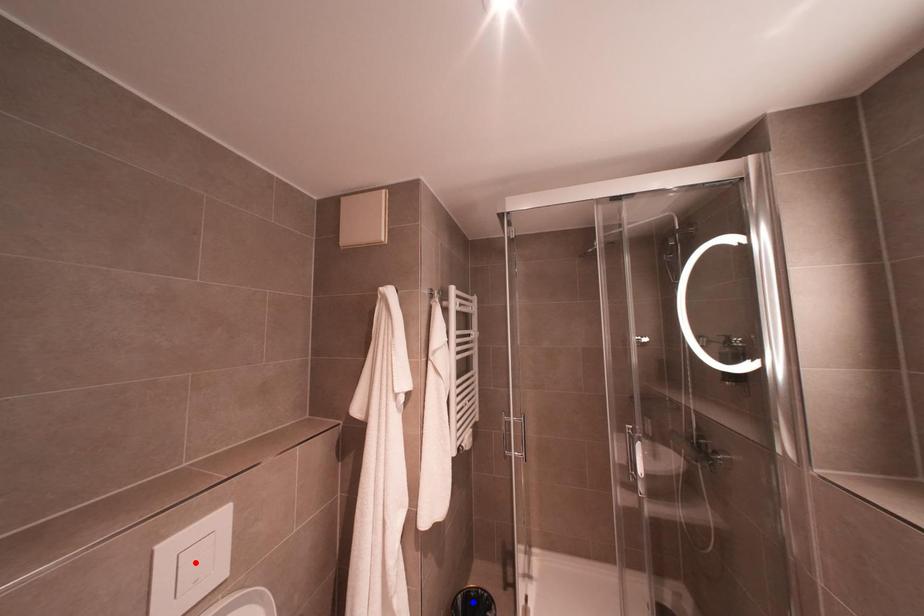
Question: Which of the two points in the image is closer to the camera?

Choices:
 (A) Blue point is closer.
 (B) Red point is closer.

Answer: (B)